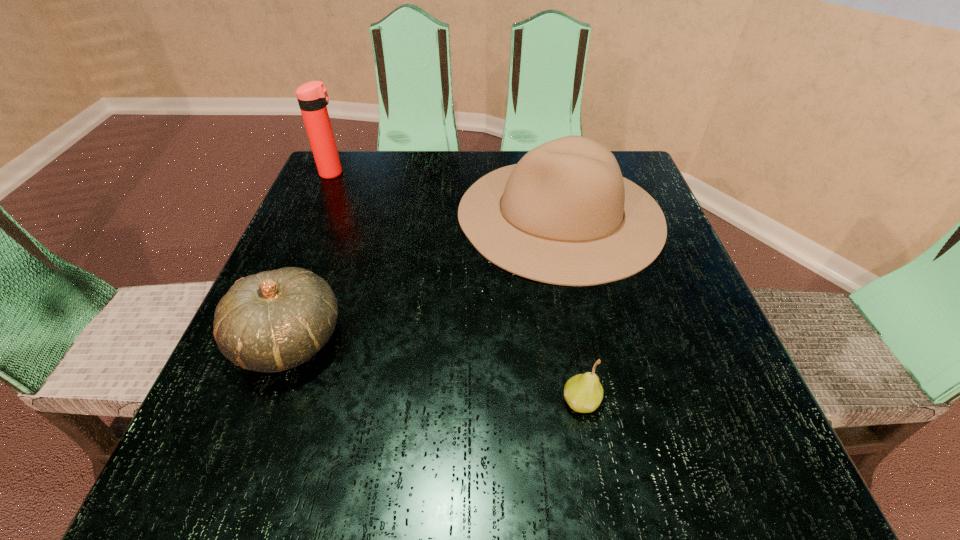
Where is `vacant region between the third tallest object and the second tallest object`? This screenshot has width=960, height=540. vacant region between the third tallest object and the second tallest object is located at coordinates (425, 278).

Where is `free space between the pear and the second tallest object`? This screenshot has width=960, height=540. free space between the pear and the second tallest object is located at coordinates (570, 308).

At what (x,y) coordinates should I click in order to perform the action: click on vacant point located between the gourd and the pear. Please return your answer as a coordinate pair (x, y). This screenshot has width=960, height=540. Looking at the image, I should click on (436, 371).

Locate an element on the screen. object that stands as the second closest to the tallest object is located at coordinates (272, 321).

Find the location of a particular element. The image size is (960, 540). the closest object relative to the gourd is located at coordinates (569, 217).

The height and width of the screenshot is (540, 960). What are the coordinates of `free space that satisfies the following two spatial constraints: 1. on the front side of the tallest object; 2. on the right side of the second shortest object` in the screenshot? It's located at (260, 340).

What are the coordinates of `vacant space that satisfies the following two spatial constraints: 1. on the back side of the second shortest object; 2. on the left side of the second tallest object` in the screenshot? It's located at (338, 215).

At what (x,y) coordinates should I click in order to perform the action: click on vacant space that satisfies the following two spatial constraints: 1. on the front side of the sombrero; 2. on the right side of the thermos bottle. Please return your answer as a coordinate pair (x, y). This screenshot has width=960, height=540. Looking at the image, I should click on (315, 215).